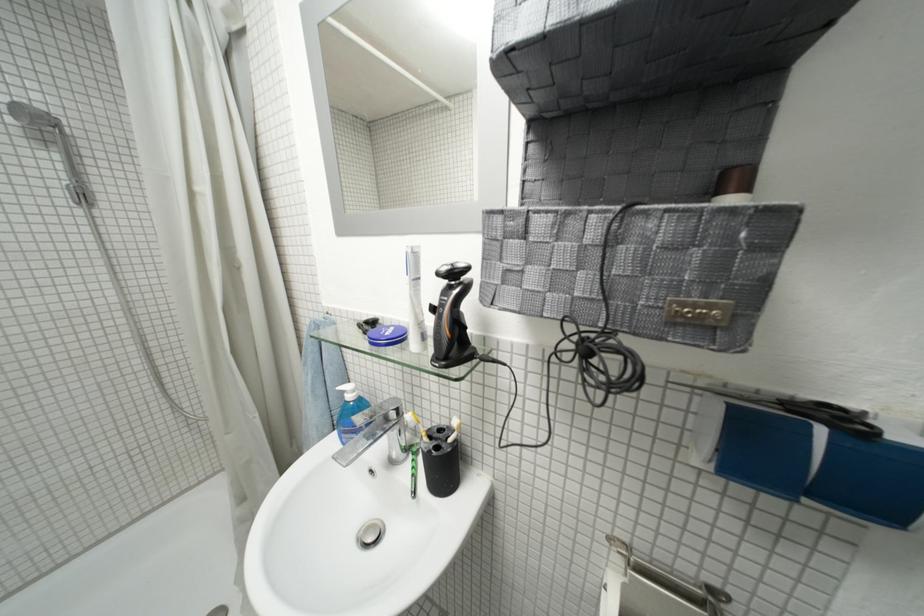
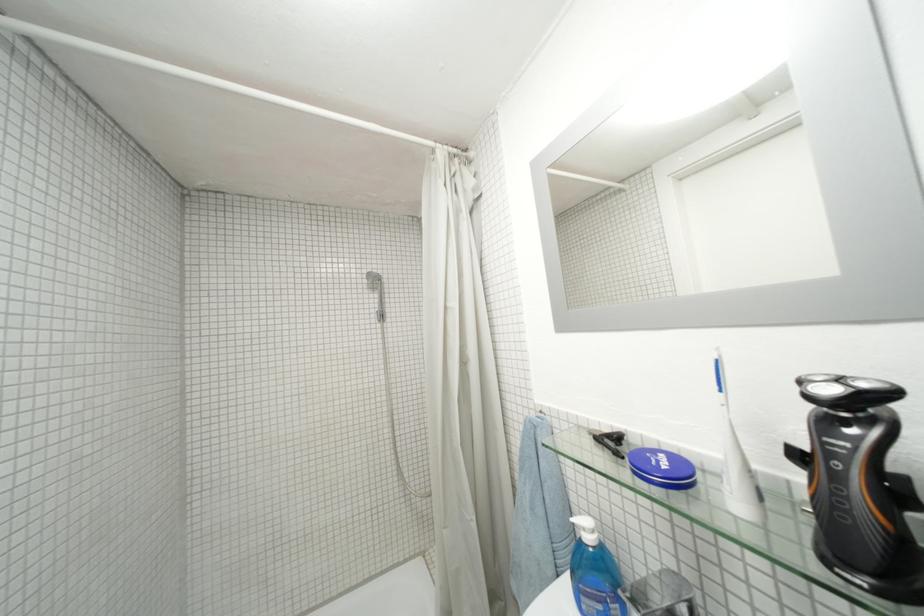
First-person continuous shooting, in which direction is the camera rotating?

The camera's rotation is toward left-up.